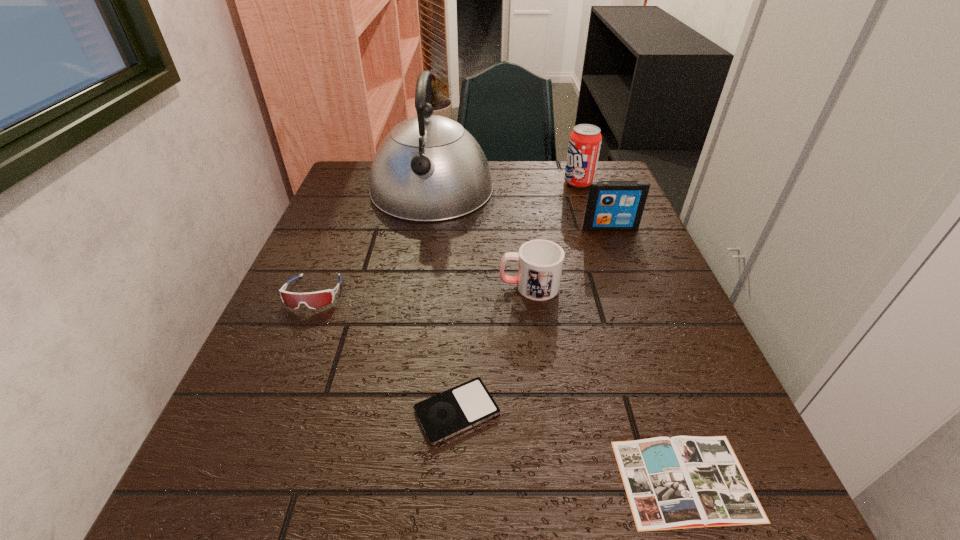
The height and width of the screenshot is (540, 960). Identify the location of free space located 0.110m on the back of the book. (649, 375).

In order to click on kettle at the far edge in this screenshot , I will do `click(428, 168)`.

The height and width of the screenshot is (540, 960). What are the coordinates of `soda can that is positioned at the far edge` in the screenshot? It's located at (585, 140).

You are a GUI agent. You are given a task and a screenshot of the screen. Output one action in this format:
    pyautogui.click(x=<x>, y=<y>)
    Task: Click on the object that is positioned at the near edge
    The height and width of the screenshot is (540, 960).
    Given the screenshot: What is the action you would take?
    pyautogui.click(x=681, y=482)

Where is `kettle situated at the left edge`? kettle situated at the left edge is located at coordinates (428, 168).

Find the location of `goggles present at the left edge`. goggles present at the left edge is located at coordinates (314, 300).

Locate an element on the screen. Image resolution: width=960 pixels, height=540 pixels. soda can located at the right edge is located at coordinates (585, 140).

In order to click on iPod located in the right edge section of the desktop in this screenshot , I will do click(x=612, y=205).

Locate an element on the screen. The height and width of the screenshot is (540, 960). book at the right edge is located at coordinates (681, 482).

You are a GUI agent. You are given a task and a screenshot of the screen. Output one action in this format:
    pyautogui.click(x=<x>, y=<y>)
    Task: Click on the object present at the far left corner
    
    Given the screenshot: What is the action you would take?
    pyautogui.click(x=428, y=168)